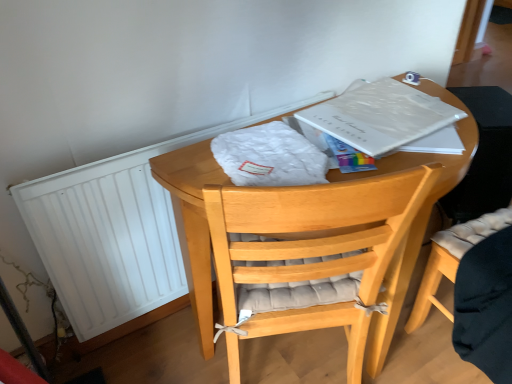
Question: Can light brown wooden chair at center be found inside wooden round table at center?

Choices:
 (A) no
 (B) yes

Answer: (A)

Question: Is wooden round table at center not near light brown wooden chair at center?

Choices:
 (A) no
 (B) yes

Answer: (A)

Question: Is wooden round table at center positioned before light brown wooden chair at center?

Choices:
 (A) no
 (B) yes

Answer: (B)

Question: From the image's perspective, is wooden round table at center beneath light brown wooden chair at center?

Choices:
 (A) yes
 (B) no

Answer: (B)

Question: From a real-world perspective, is wooden round table at center below light brown wooden chair at center?

Choices:
 (A) no
 (B) yes

Answer: (A)

Question: Considering the relative sizes of wooden round table at center and light brown wooden chair at center in the image provided, is wooden round table at center smaller than light brown wooden chair at center?

Choices:
 (A) yes
 (B) no

Answer: (B)

Question: Considering the relative positions of white paper at upper right and white matte radiator at left in the image provided, is white paper at upper right to the right of white matte radiator at left from the viewer's perspective?

Choices:
 (A) yes
 (B) no

Answer: (A)

Question: Can you confirm if white paper at upper right is smaller than white matte radiator at left?

Choices:
 (A) no
 (B) yes

Answer: (B)

Question: Is white paper at upper right far from white matte radiator at left?

Choices:
 (A) yes
 (B) no

Answer: (B)

Question: Is white paper at upper right shorter than white matte radiator at left?

Choices:
 (A) no
 (B) yes

Answer: (B)

Question: Is the surface of white paper at upper right in direct contact with white matte radiator at left?

Choices:
 (A) yes
 (B) no

Answer: (B)

Question: Is white paper at upper right at the left side of white matte radiator at left?

Choices:
 (A) yes
 (B) no

Answer: (B)

Question: Can you confirm if light brown wooden chair at center is smaller than white paper at upper right?

Choices:
 (A) yes
 (B) no

Answer: (B)